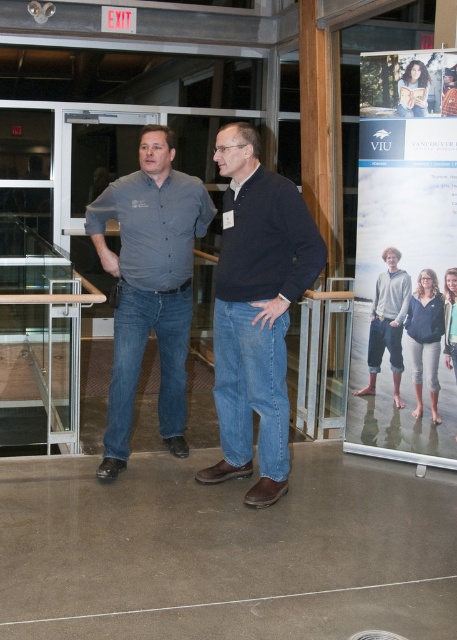
Question: Which object is closer to the camera taking this photo?

Choices:
 (A) matte white banner at upper right
 (B) dark blue sweater at center
 (C) matte black hair at upper center
 (D) gray cotton hoodie at center

Answer: (B)

Question: Is gray cotton hoodie at center to the right of matte black hair at upper center from the viewer's perspective?

Choices:
 (A) no
 (B) yes

Answer: (A)

Question: Which of the following is the farthest from the observer?

Choices:
 (A) blue denim jeans at center
 (B) matte white banner at upper right
 (C) matte gray shirt at center
 (D) dark blue sweater at center

Answer: (A)

Question: Is matte gray shirt at center wider than blue denim jeans at center?

Choices:
 (A) yes
 (B) no

Answer: (A)

Question: Estimate the real-world distances between objects in this image. Which object is farther from the blue denim jeans at center?

Choices:
 (A) matte white banner at upper right
 (B) matte black hair at upper center
 (C) matte gray shirt at center
 (D) dark blue sweater at center

Answer: (C)

Question: Can you confirm if matte white banner at upper right is positioned below blue denim jeans at center?

Choices:
 (A) yes
 (B) no

Answer: (B)